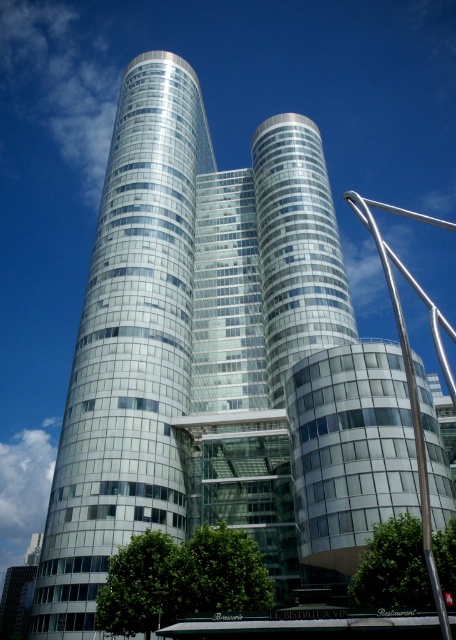
Question: Is glassy silver tower at center above silver metallic pole at right?

Choices:
 (A) no
 (B) yes

Answer: (A)

Question: Which point is farther from the camera taking this photo?

Choices:
 (A) (50, 500)
 (B) (355, 195)

Answer: (B)

Question: Can you confirm if glassy silver tower at center is positioned to the left of silver metallic pole at right?

Choices:
 (A) no
 (B) yes

Answer: (B)

Question: Which point is farther to the camera?

Choices:
 (A) glassy silver tower at center
 (B) silver metallic pole at right

Answer: (A)

Question: Does glassy silver tower at center appear under silver metallic pole at right?

Choices:
 (A) yes
 (B) no

Answer: (A)